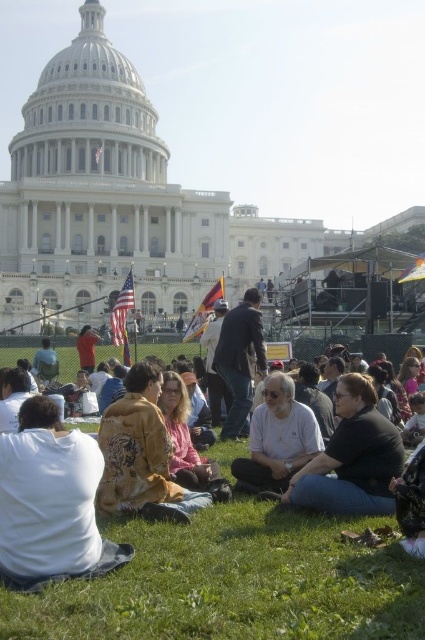
Question: Is green grass at lower center above white cotton shirt at center?

Choices:
 (A) no
 (B) yes

Answer: (A)

Question: Which object is the farthest from the white cotton shirt at center?

Choices:
 (A) gold textured jacket at center
 (B) dark gray fabric jacket at center
 (C) green grass at lower center

Answer: (C)

Question: Can you confirm if green grass at lower center is positioned to the left of dark gray fabric jacket at center?

Choices:
 (A) yes
 (B) no

Answer: (A)

Question: Which object appears farthest from the camera in this image?

Choices:
 (A) white cotton shirt at center
 (B) dark gray fabric jacket at center
 (C) gold textured jacket at center
 (D) green grass at lower center

Answer: (A)

Question: Is green grass at lower center bigger than white cotton shirt at center?

Choices:
 (A) yes
 (B) no

Answer: (A)

Question: Estimate the real-world distances between objects in this image. Which object is closer to the green grass at lower center?

Choices:
 (A) gold textured jacket at center
 (B) white cotton shirt at center
 (C) dark gray fabric jacket at center

Answer: (A)